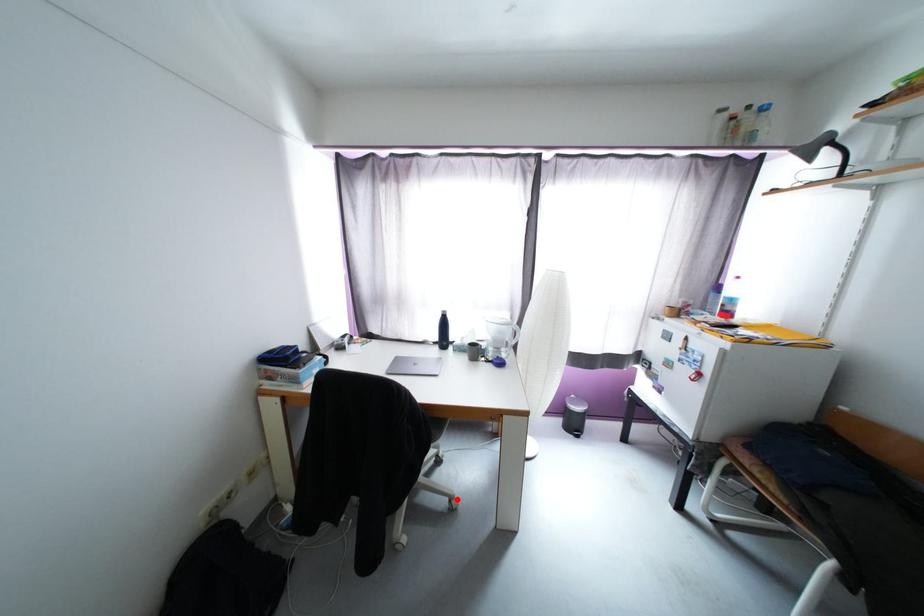
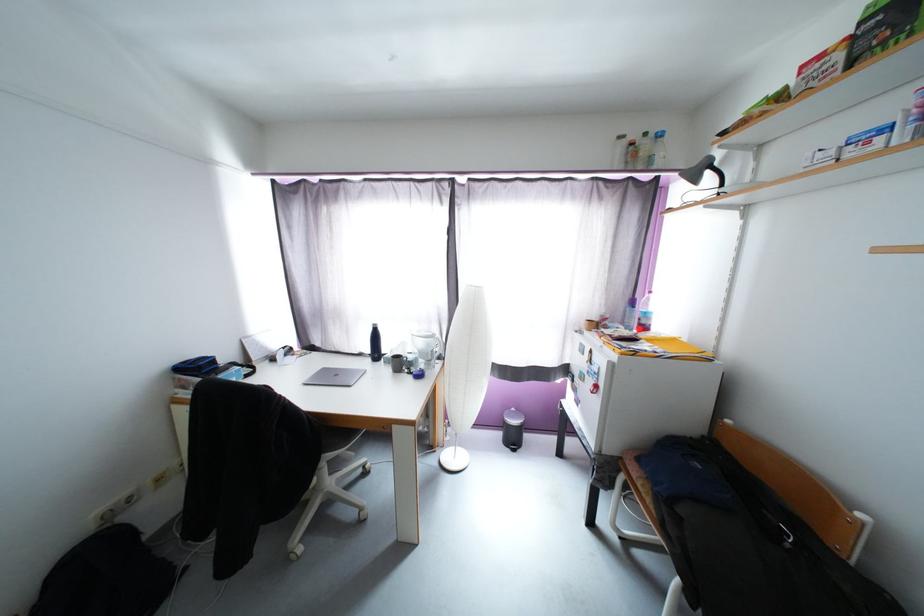
Question: I am providing you with two images of the same scene from different viewpoints. Given a red point in image1, look at the same physical point in image2. Is it:

Choices:
 (A) Closer to the viewpoint
 (B) Farther from the viewpoint

Answer: (A)